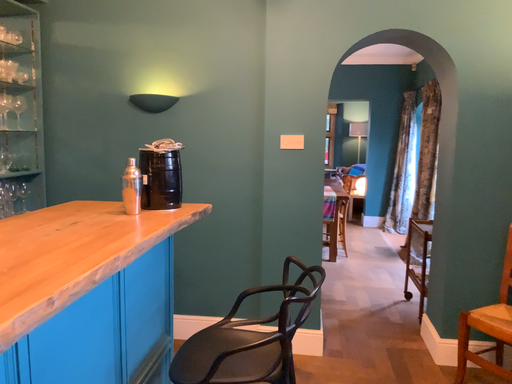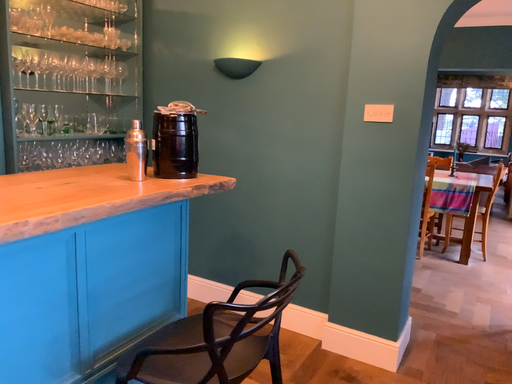
Question: Which way did the camera rotate in the video?

Choices:
 (A) rotated right
 (B) rotated left

Answer: (B)